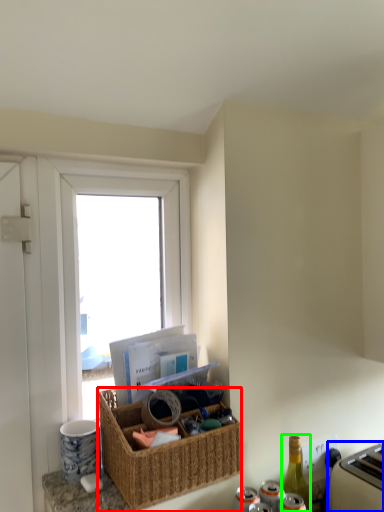
Question: Which is farther away from picnic basket (highlighted by a red box)? appliance (highlighted by a blue box) or bottle (highlighted by a green box)?

Choices:
 (A) appliance
 (B) bottle

Answer: (A)